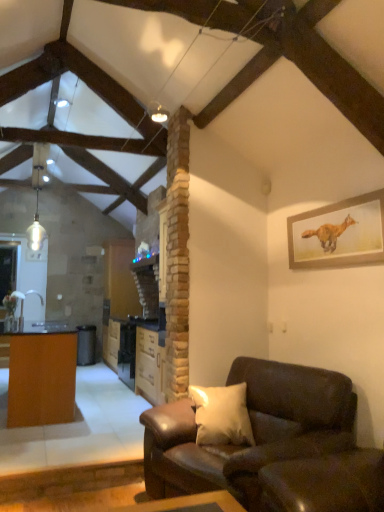
Question: Is wooden table at left taller than brown wood cabinet at center?

Choices:
 (A) no
 (B) yes

Answer: (B)

Question: Is wooden table at left thinner than brown wood cabinet at center?

Choices:
 (A) no
 (B) yes

Answer: (A)

Question: From the image's perspective, is wooden table at left beneath brown wood cabinet at center?

Choices:
 (A) yes
 (B) no

Answer: (A)

Question: Is wooden table at left facing away from brown wood cabinet at center?

Choices:
 (A) no
 (B) yes

Answer: (B)

Question: Considering the relative positions of wooden table at left and brown wood cabinet at center in the image provided, is wooden table at left to the right of brown wood cabinet at center from the viewer's perspective?

Choices:
 (A) yes
 (B) no

Answer: (B)

Question: Is wooden table at left to the left of brown wood cabinet at center from the viewer's perspective?

Choices:
 (A) yes
 (B) no

Answer: (A)

Question: Can you confirm if wooden framed fox painting at upper right is taller than leather couch at lower right?

Choices:
 (A) no
 (B) yes

Answer: (A)

Question: Is wooden framed fox painting at upper right not close to leather couch at lower right?

Choices:
 (A) no
 (B) yes

Answer: (B)

Question: Does wooden framed fox painting at upper right touch leather couch at lower right?

Choices:
 (A) yes
 (B) no

Answer: (B)

Question: Is wooden framed fox painting at upper right completely or partially outside of leather couch at lower right?

Choices:
 (A) yes
 (B) no

Answer: (A)

Question: From the image's perspective, is wooden framed fox painting at upper right below leather couch at lower right?

Choices:
 (A) yes
 (B) no

Answer: (B)

Question: From a real-world perspective, does wooden framed fox painting at upper right sit lower than leather couch at lower right?

Choices:
 (A) yes
 (B) no

Answer: (B)

Question: From the image's perspective, is brown wood cabinet at center under wooden framed fox painting at upper right?

Choices:
 (A) no
 (B) yes

Answer: (B)